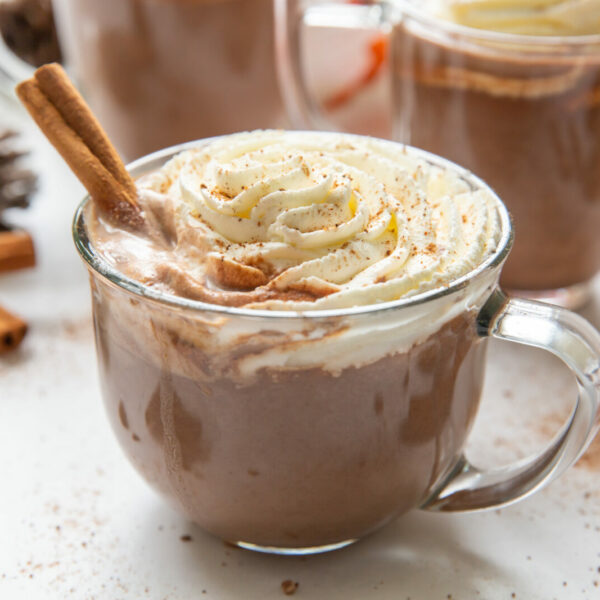
At what (x,y) coordinates should I click in order to perform the action: click on mug. Please return your answer as a coordinate pair (x, y). Looking at the image, I should click on (488, 127).